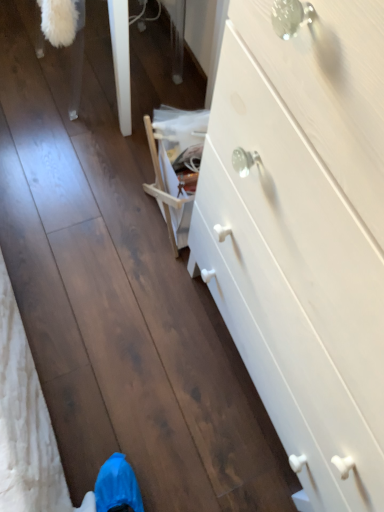
Locate an element on the screen. vacant space to the left of white wood chest of drawers at right is located at coordinates (119, 325).